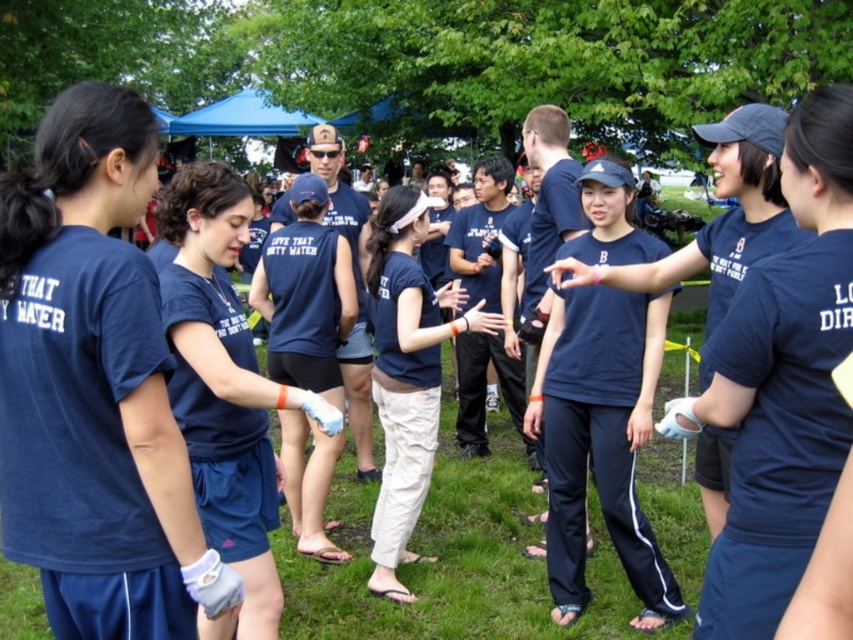
You are a photographer at the event and need to capture a photo of the navy blue fabric tank top at center. The camera is currently focused on the point at coordinates (x=225, y=388). Is the camera focused on the correct subject?

Yes, the camera is focused on the correct subject because the point at coordinates (x=225, y=388) indicates the navy blue fabric tank top at center.

You are a photographer trying to capture a clear photo of the navy blue sleeveless shirt at center. However, the navy blue jersey at left is blocking the view. Can you move the jersey to the side to get a better shot?

The navy blue jersey at left is in front of the navy blue sleeveless shirt at center, so moving the jersey to the side would allow you to see the navy blue sleeveless shirt at center clearly.